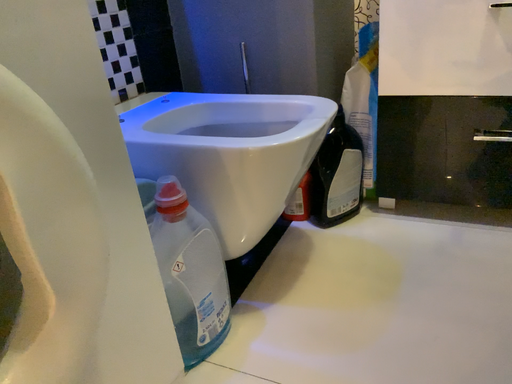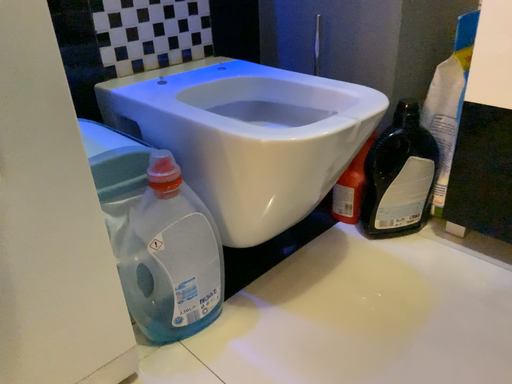
Question: Which way did the camera rotate in the video?

Choices:
 (A) rotated left
 (B) rotated right

Answer: (A)